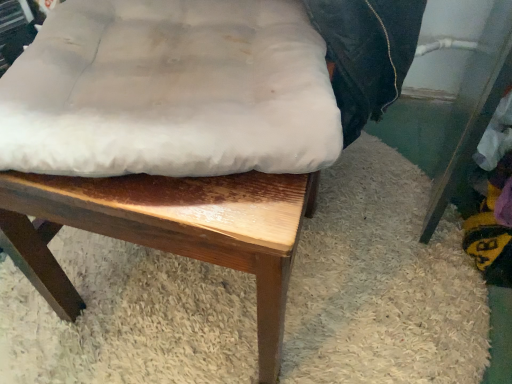
Question: Considering the positions of white fabric cushion at center and white fabric cushion at center in the image, is white fabric cushion at center bigger or smaller than white fabric cushion at center?

Choices:
 (A) small
 (B) big

Answer: (B)

Question: In terms of width, does white fabric cushion at center look wider or thinner when compared to white fabric cushion at center?

Choices:
 (A) thin
 (B) wide

Answer: (B)

Question: Is white fabric cushion at center inside or outside of white fabric cushion at center?

Choices:
 (A) inside
 (B) outside

Answer: (B)

Question: From a real-world perspective, relative to white fabric cushion at center, is white fabric cushion at center vertically above or below?

Choices:
 (A) above
 (B) below

Answer: (A)

Question: Which is correct: white fabric cushion at center is inside white fabric cushion at center, or outside of it?

Choices:
 (A) outside
 (B) inside

Answer: (B)

Question: Is point coord(251,139) closer or farther from the camera than point coord(86,210)?

Choices:
 (A) farther
 (B) closer

Answer: (B)

Question: In the image, is white fabric cushion at center positioned in front of or behind white fabric cushion at center?

Choices:
 (A) front
 (B) behind

Answer: (B)